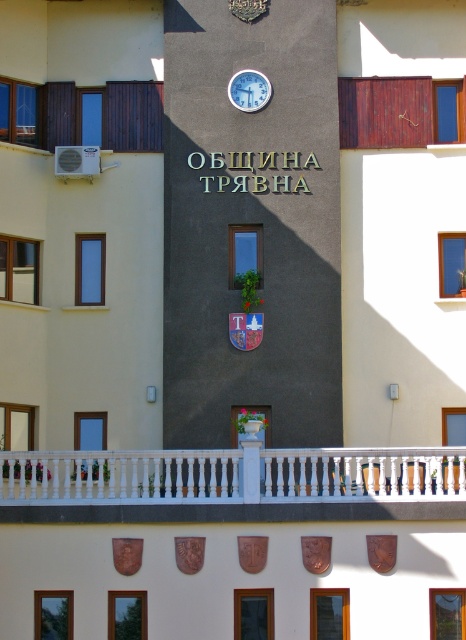
This screenshot has height=640, width=466. Describe the element at coordinates (233, 476) in the screenshot. I see `white wooden railing at center` at that location.

Between white wooden railing at center and white plastic clock at upper center, which one is positioned lower?

white wooden railing at center

Is point (178, 468) less distant than point (230, 84)?

Yes.

The width and height of the screenshot is (466, 640). What are the coordinates of `white wooden railing at center` in the screenshot? It's located at (233, 476).